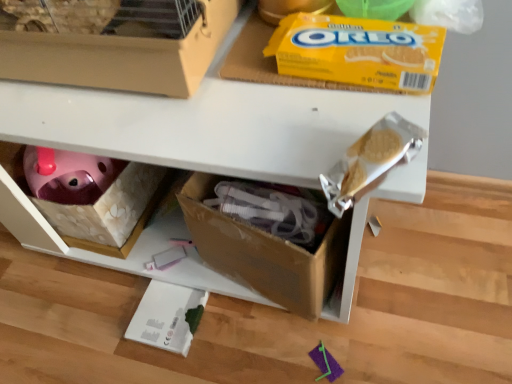
Question: Considering the positions of yellow cardboard oreo at upper center and matte cardboard box at upper left in the image, is yellow cardboard oreo at upper center wider or thinner than matte cardboard box at upper left?

Choices:
 (A) wide
 (B) thin

Answer: (B)

Question: From the image's perspective, relative to matte cardboard box at upper left, is yellow cardboard oreo at upper center above or below?

Choices:
 (A) above
 (B) below

Answer: (B)

Question: Based on their relative distances, which object is farther from the yellow cardboard oreo at upper center?

Choices:
 (A) cardboard box at lower center
 (B) matte cardboard box at upper left

Answer: (A)

Question: Which of these objects is positioned farthest from the yellow cardboard oreo at upper center?

Choices:
 (A) cardboard box at lower center
 (B) matte cardboard box at upper left

Answer: (A)